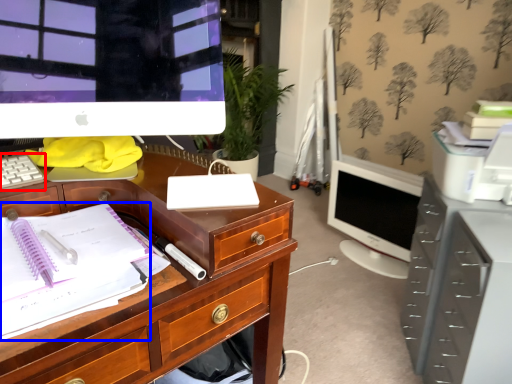
Question: Which point is closer to the camera, computer keyboard (highlighted by a red box) or office supplies (highlighted by a blue box)?

Choices:
 (A) computer keyboard
 (B) office supplies

Answer: (B)